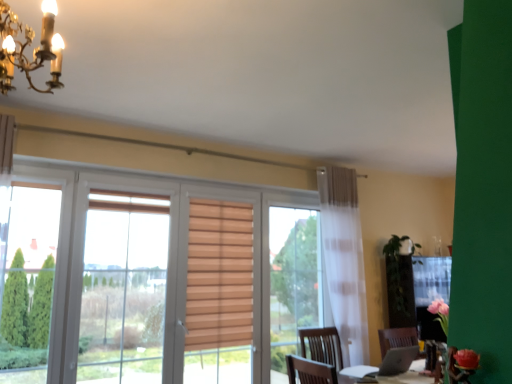
Question: From a real-world perspective, is gold metallic chandelier at upper left physically above green matte plant at right?

Choices:
 (A) no
 (B) yes

Answer: (B)

Question: Does gold metallic chandelier at upper left lie behind green matte plant at right?

Choices:
 (A) no
 (B) yes

Answer: (A)

Question: Is gold metallic chandelier at upper left at the right side of green matte plant at right?

Choices:
 (A) no
 (B) yes

Answer: (A)

Question: Does gold metallic chandelier at upper left come in front of green matte plant at right?

Choices:
 (A) no
 (B) yes

Answer: (B)

Question: Is gold metallic chandelier at upper left outside of green matte plant at right?

Choices:
 (A) yes
 (B) no

Answer: (A)

Question: Is gold metallic chandelier at upper left thinner than green matte plant at right?

Choices:
 (A) no
 (B) yes

Answer: (B)

Question: Is green matte plant at right not close to gold metallic chandelier at upper left?

Choices:
 (A) no
 (B) yes

Answer: (B)

Question: Is green matte plant at right oriented towards gold metallic chandelier at upper left?

Choices:
 (A) no
 (B) yes

Answer: (A)

Question: Could gold metallic chandelier at upper left be considered to be inside green matte plant at right?

Choices:
 (A) no
 (B) yes

Answer: (A)

Question: From the image's perspective, is green matte plant at right over gold metallic chandelier at upper left?

Choices:
 (A) no
 (B) yes

Answer: (A)

Question: From a real-world perspective, is green matte plant at right located higher than gold metallic chandelier at upper left?

Choices:
 (A) yes
 (B) no

Answer: (B)

Question: Can you confirm if green matte plant at right is wider than gold metallic chandelier at upper left?

Choices:
 (A) yes
 (B) no

Answer: (A)

Question: Looking at their shapes, would you say gold metallic chandelier at upper left is wider or thinner than green matte plant at right?

Choices:
 (A) thin
 (B) wide

Answer: (A)